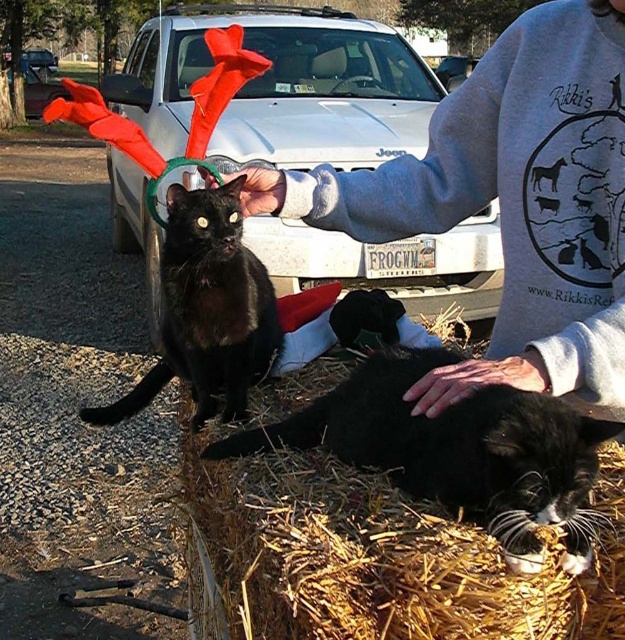
Question: Is black fur at lower right below black matte fur cat at left?

Choices:
 (A) yes
 (B) no

Answer: (A)

Question: Considering the real-world distances, which object is farthest from the gray fleece sweatshirt at upper center?

Choices:
 (A) black fur at lower right
 (B) black matte fur cat at left

Answer: (B)

Question: Which object is farther from the camera taking this photo?

Choices:
 (A) gray fleece sweatshirt at upper center
 (B) black fur at lower right

Answer: (A)

Question: In this image, where is gray fleece sweatshirt at upper center located relative to black fur at lower right?

Choices:
 (A) right
 (B) left

Answer: (A)

Question: Can you confirm if black fur at lower right is positioned below black matte fur cat at left?

Choices:
 (A) yes
 (B) no

Answer: (A)

Question: Estimate the real-world distances between objects in this image. Which object is farther from the black matte fur cat at left?

Choices:
 (A) gray fleece sweatshirt at upper center
 (B) black fur at lower right

Answer: (B)